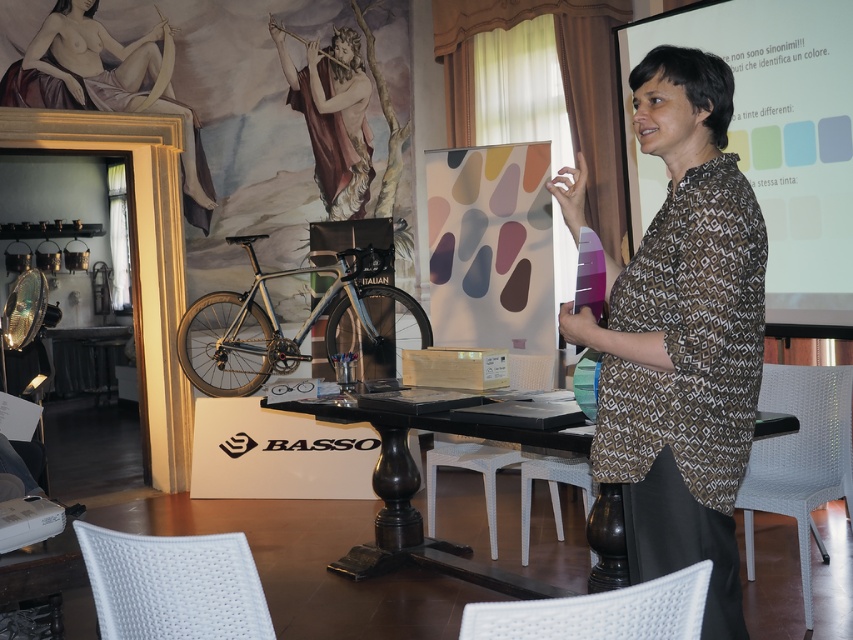
You are an attendee at the presentation and notice two items on the table. One is a matte gold frame at upper left and the other is a matte gold flute at upper center. Which item is closer to you from your perspective?

The matte gold frame at upper left is closer to you because it is positioned in front of the matte gold flute at upper center.

You are an interior designer observing the presentation setup. You notice the matte gold frame at upper left and the matte gold flute at upper center. Which object is positioned higher up in the image?

The matte gold flute at upper center is positioned higher up in the image than the matte gold frame at upper left, which is located below it.

What is located at the coordinates point (682,339) in the image?

The brown printed shirt at center is located at point (682,339).